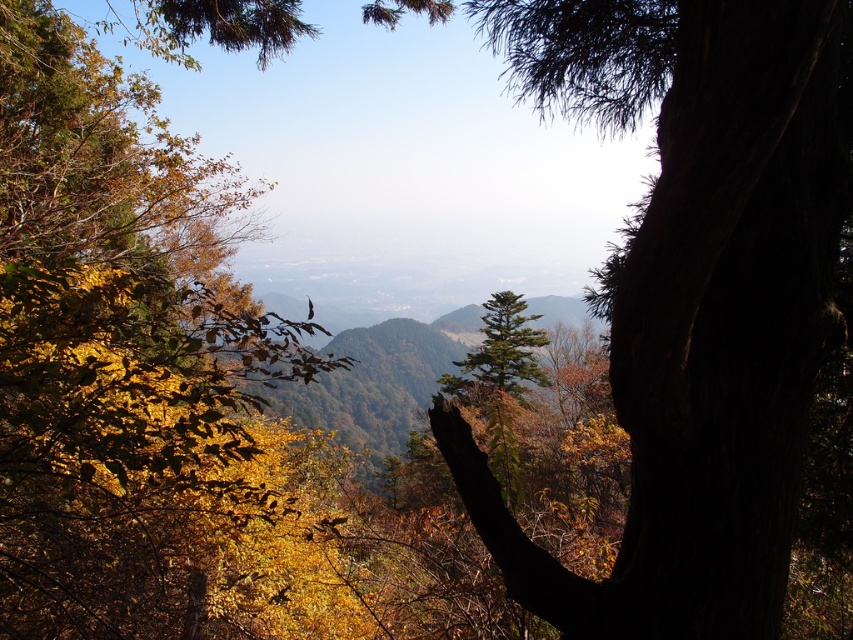
Question: Can you confirm if dark green textured tree trunk at center is positioned to the right of green matte tree at upper left?

Choices:
 (A) yes
 (B) no

Answer: (A)

Question: Which of the following is the closest to the observer?

Choices:
 (A) green matte tree at upper left
 (B) dark green textured tree trunk at center

Answer: (B)

Question: Is dark green textured tree trunk at center positioned behind green matte tree at upper left?

Choices:
 (A) no
 (B) yes

Answer: (A)

Question: Does dark green textured tree trunk at center have a larger size compared to green matte tree at upper left?

Choices:
 (A) yes
 (B) no

Answer: (A)

Question: Which point is farther to the camera?

Choices:
 (A) (791, 83)
 (B) (155, 280)

Answer: (B)

Question: Which of the following is the closest to the observer?

Choices:
 (A) (531, 19)
 (B) (57, 204)

Answer: (A)